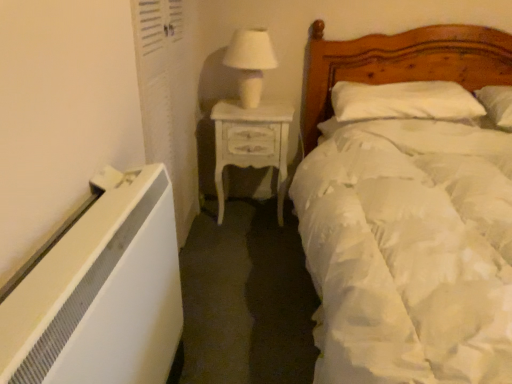
Question: Is white painted wood nightstand at center to the left of white glossy table lamp at upper center from the viewer's perspective?

Choices:
 (A) yes
 (B) no

Answer: (B)

Question: Is white painted wood nightstand at center touching white glossy table lamp at upper center?

Choices:
 (A) yes
 (B) no

Answer: (B)

Question: Does white painted wood nightstand at center have a lesser width compared to white glossy table lamp at upper center?

Choices:
 (A) yes
 (B) no

Answer: (B)

Question: Is white painted wood nightstand at center positioned with its back to white glossy table lamp at upper center?

Choices:
 (A) yes
 (B) no

Answer: (B)

Question: Does white painted wood nightstand at center lie behind white glossy table lamp at upper center?

Choices:
 (A) no
 (B) yes

Answer: (B)

Question: Can you confirm if white painted wood nightstand at center is shorter than white glossy table lamp at upper center?

Choices:
 (A) no
 (B) yes

Answer: (A)

Question: Does wooden bed at right have a greater height compared to white painted wood nightstand at center?

Choices:
 (A) no
 (B) yes

Answer: (B)

Question: Considering the relative sizes of wooden bed at right and white painted wood nightstand at center in the image provided, is wooden bed at right shorter than white painted wood nightstand at center?

Choices:
 (A) no
 (B) yes

Answer: (A)

Question: From a real-world perspective, is wooden bed at right positioned under white painted wood nightstand at center based on gravity?

Choices:
 (A) no
 (B) yes

Answer: (A)

Question: From the image's perspective, is wooden bed at right on top of white painted wood nightstand at center?

Choices:
 (A) yes
 (B) no

Answer: (B)

Question: Is white painted wood nightstand at center at the back of wooden bed at right?

Choices:
 (A) no
 (B) yes

Answer: (A)

Question: Are wooden bed at right and white painted wood nightstand at center making contact?

Choices:
 (A) no
 (B) yes

Answer: (A)

Question: From a real-world perspective, is wooden bed at right below white soft pillow at upper right?

Choices:
 (A) no
 (B) yes

Answer: (B)